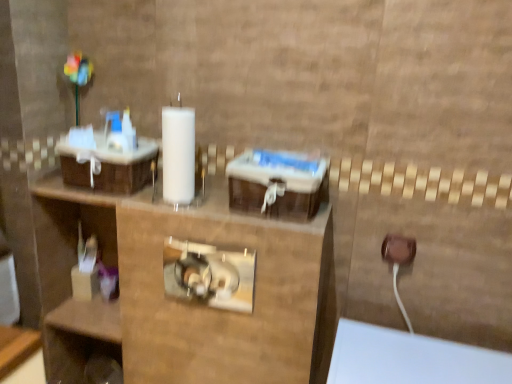
Question: Is brown plastic outlet at lower right positioned beyond the bounds of translucent plastic container at lower left?

Choices:
 (A) no
 (B) yes

Answer: (B)

Question: From a real-world perspective, is brown plastic outlet at lower right located beneath translucent plastic container at lower left?

Choices:
 (A) no
 (B) yes

Answer: (A)

Question: Considering the relative sizes of brown plastic outlet at lower right and translucent plastic container at lower left in the image provided, is brown plastic outlet at lower right thinner than translucent plastic container at lower left?

Choices:
 (A) yes
 (B) no

Answer: (A)

Question: From a real-world perspective, is brown plastic outlet at lower right on translucent plastic container at lower left?

Choices:
 (A) no
 (B) yes

Answer: (B)

Question: Are brown plastic outlet at lower right and translucent plastic container at lower left far apart?

Choices:
 (A) yes
 (B) no

Answer: (B)

Question: Does brown plastic outlet at lower right have a greater height compared to translucent plastic container at lower left?

Choices:
 (A) yes
 (B) no

Answer: (B)

Question: Is brown woven basket at left completely or partially outside of brown plastic outlet at lower right?

Choices:
 (A) no
 (B) yes

Answer: (B)

Question: From a real-world perspective, is brown woven basket at left below brown plastic outlet at lower right?

Choices:
 (A) yes
 (B) no

Answer: (B)

Question: Can you confirm if brown woven basket at left is thinner than brown plastic outlet at lower right?

Choices:
 (A) yes
 (B) no

Answer: (B)

Question: Can you confirm if brown woven basket at left is bigger than brown plastic outlet at lower right?

Choices:
 (A) no
 (B) yes

Answer: (B)

Question: Considering the relative sizes of brown woven basket at left and brown plastic outlet at lower right in the image provided, is brown woven basket at left smaller than brown plastic outlet at lower right?

Choices:
 (A) yes
 (B) no

Answer: (B)

Question: From a real-world perspective, does brown woven basket at left stand above brown plastic outlet at lower right?

Choices:
 (A) yes
 (B) no

Answer: (A)

Question: Is brown plastic outlet at lower right with brown woven basket at left?

Choices:
 (A) no
 (B) yes

Answer: (A)